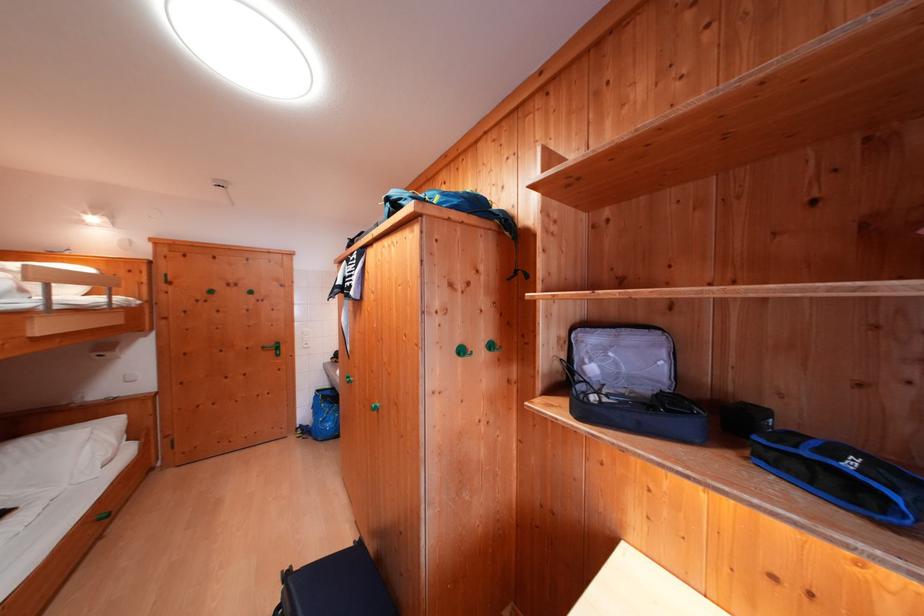
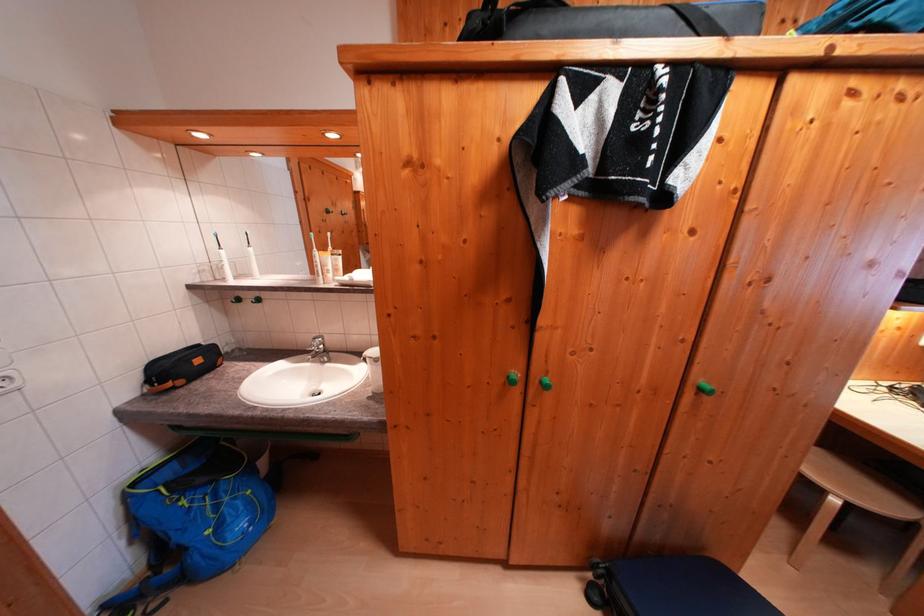
In the second image, find the point that corresponds to point 326,395 in the first image.

(142, 488)